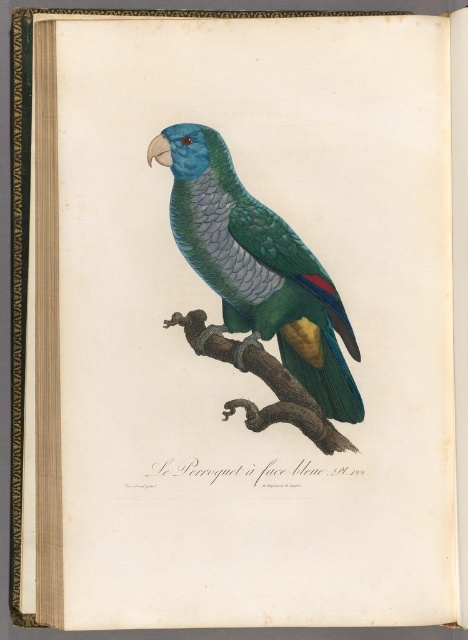
Question: Which of the following is the closest to the observer?

Choices:
 (A) shiny green parrot at center
 (B) brown rough tree branch at center

Answer: (A)

Question: Is shiny green parrot at center below brown rough tree branch at center?

Choices:
 (A) yes
 (B) no

Answer: (B)

Question: Which object is farther from the camera taking this photo?

Choices:
 (A) brown rough tree branch at center
 (B) shiny green parrot at center

Answer: (A)

Question: Is shiny green parrot at center thinner than brown rough tree branch at center?

Choices:
 (A) yes
 (B) no

Answer: (B)

Question: Does shiny green parrot at center have a lesser width compared to brown rough tree branch at center?

Choices:
 (A) no
 (B) yes

Answer: (A)